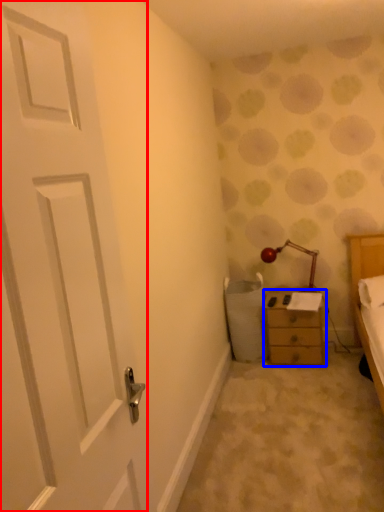
Question: Which of the following is the farthest to the observer, door (highlighted by a red box) or chest of drawers (highlighted by a blue box)?

Choices:
 (A) door
 (B) chest of drawers

Answer: (B)